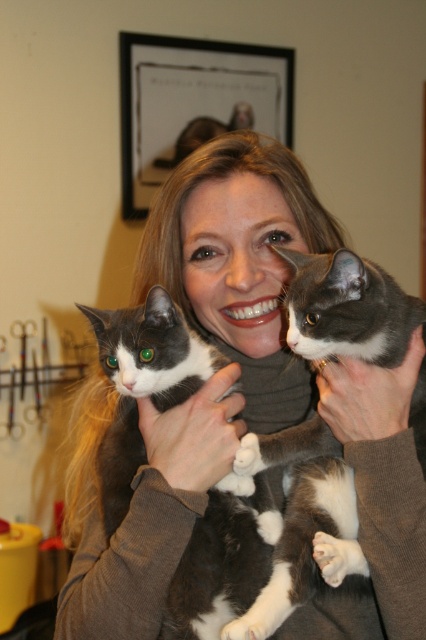
Which of these two, matte gray sweater at center or soft gray sweater at center, stands shorter?

With less height is soft gray sweater at center.

Is point (213, 300) closer to camera compared to point (169, 518)?

No, (213, 300) is behind (169, 518).

You are a GUI agent. You are given a task and a screenshot of the screen. Output one action in this format:
    pyautogui.click(x=<x>, y=<y>)
    Task: Click on the matte gray sweater at center
    The height and width of the screenshot is (640, 426).
    Given the screenshot: What is the action you would take?
    pyautogui.click(x=242, y=406)

Does matte gray sweater at center have a larger size compared to soft gray fur at upper right?

Yes.

Can you confirm if matte gray sweater at center is positioned to the right of soft gray fur at upper right?

No, matte gray sweater at center is not to the right of soft gray fur at upper right.

Locate an element on the screen. The height and width of the screenshot is (640, 426). matte gray sweater at center is located at coordinates (242, 406).

Is point (69, 634) closer to viewer compared to point (388, 404)?

No.

Is soft gray sweater at center smaller than soft gray fur at upper right?

Result: No.

Identify the location of soft gray sweater at center. (150, 516).